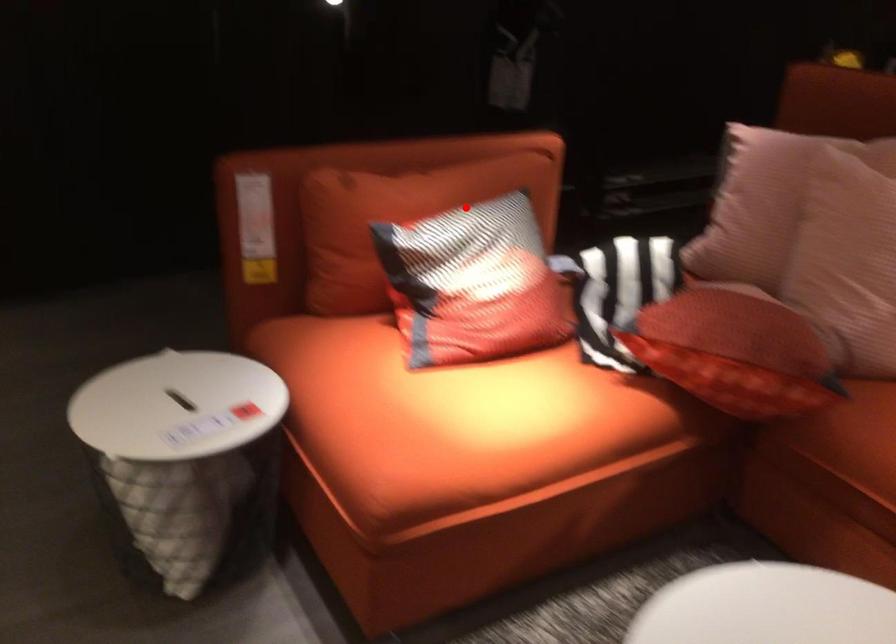
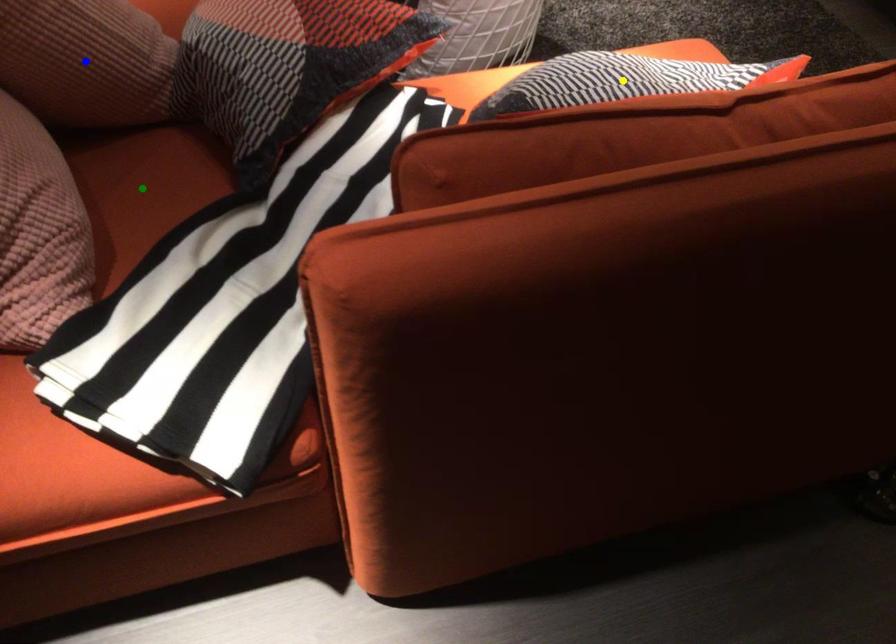
Question: I am providing you with two images of the same scene from different viewpoints. A red point is marked on the first image. You are given multiple points on the second image. Which spot in image 2 lines up with the point in image 1?

Choices:
 (A) green point
 (B) yellow point
 (C) blue point

Answer: (B)